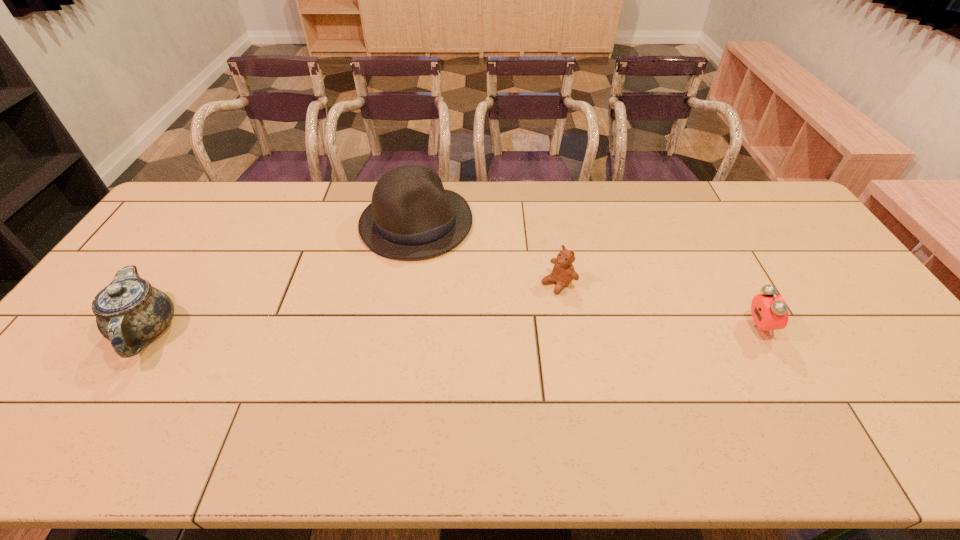
I want to click on free space between the second object from right to left and the second tallest object, so click(x=352, y=306).

Locate an element on the screen. This screenshot has width=960, height=540. free point between the teddy bear and the bowler hat is located at coordinates (488, 253).

Identify the location of free space between the third shortest object and the teddy bear. The image size is (960, 540). (352, 306).

Where is `free area in between the second object from right to left and the bowler hat`? Image resolution: width=960 pixels, height=540 pixels. free area in between the second object from right to left and the bowler hat is located at coordinates click(488, 253).

The image size is (960, 540). I want to click on free space between the teddy bear and the leftmost object, so click(352, 306).

Where is `vacant region between the alarm clock and the farthest object`? The height and width of the screenshot is (540, 960). vacant region between the alarm clock and the farthest object is located at coordinates (588, 275).

This screenshot has height=540, width=960. I want to click on vacant space in between the bowler hat and the third shortest object, so 281,276.

Find the location of a particular element. The image size is (960, 540). blank region between the chinaware and the alarm clock is located at coordinates (452, 328).

The height and width of the screenshot is (540, 960). In order to click on free spot between the second object from right to left and the rightmost object in this screenshot , I will do `click(658, 305)`.

Where is `object identified as the closest to the teddy bear`? object identified as the closest to the teddy bear is located at coordinates (412, 216).